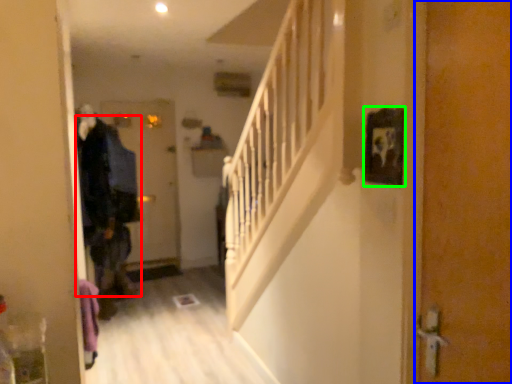
Question: Considering the real-world distances, which object is closest to clothing (highlighted by a red box)? door (highlighted by a blue box) or picture frame (highlighted by a green box).

Choices:
 (A) door
 (B) picture frame

Answer: (B)